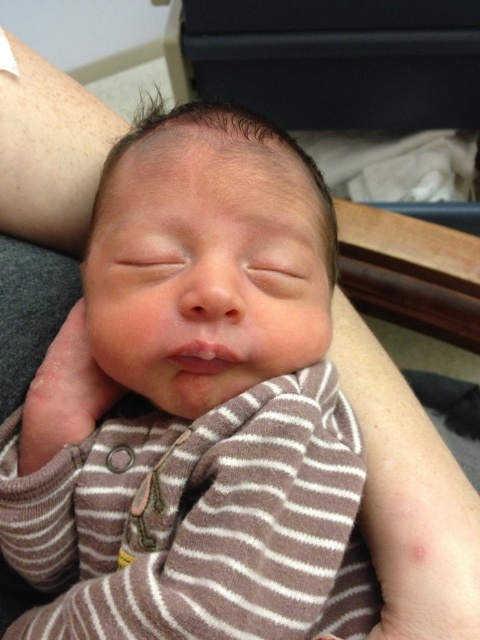
Who is taller, brown striped onesie at center or smooth skin at lower right?

brown striped onesie at center

Does brown striped onesie at center have a lesser height compared to smooth skin at lower right?

No.

Between point (97, 204) and point (367, 342), which one is positioned behind?

Point (367, 342)

Find the location of a particular element. brown striped onesie at center is located at coordinates (197, 406).